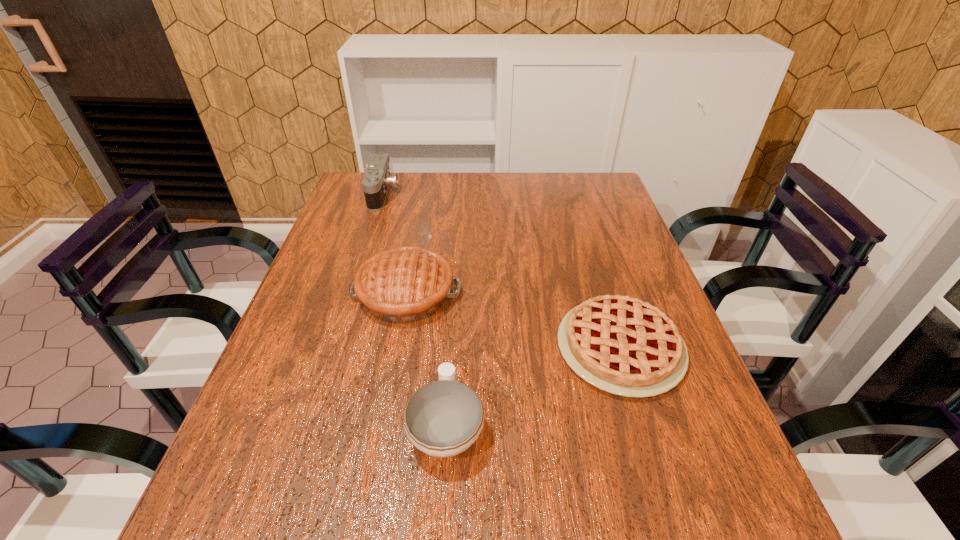
Locate an element on the screen. free space located on the front of the right pie is located at coordinates (647, 435).

The height and width of the screenshot is (540, 960). What are the coordinates of `object that is at the far edge` in the screenshot? It's located at (377, 180).

Image resolution: width=960 pixels, height=540 pixels. I want to click on camera located in the left edge section of the desktop, so click(377, 180).

Identify the location of pie that is at the left edge. This screenshot has width=960, height=540. (401, 285).

At what (x,y) coordinates should I click in order to perform the action: click on object present at the right edge. Please return your answer as a coordinate pair (x, y). Looking at the image, I should click on (622, 345).

Where is `object at the far left corner`? The height and width of the screenshot is (540, 960). object at the far left corner is located at coordinates (377, 180).

Where is `vacant space at the far edge of the desktop`? vacant space at the far edge of the desktop is located at coordinates (449, 195).

Find the location of a particular element. This screenshot has height=540, width=960. vacant space at the near edge of the desktop is located at coordinates (315, 505).

Locate an element on the screen. The width and height of the screenshot is (960, 540). free space at the left edge of the desktop is located at coordinates (326, 310).

The image size is (960, 540). Find the location of `free space at the right edge of the desktop`. free space at the right edge of the desktop is located at coordinates (681, 393).